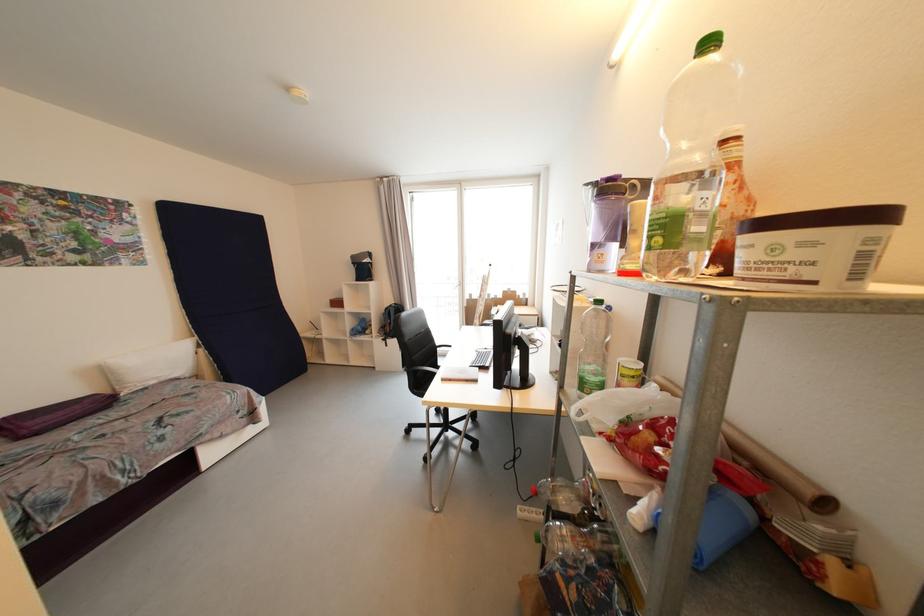
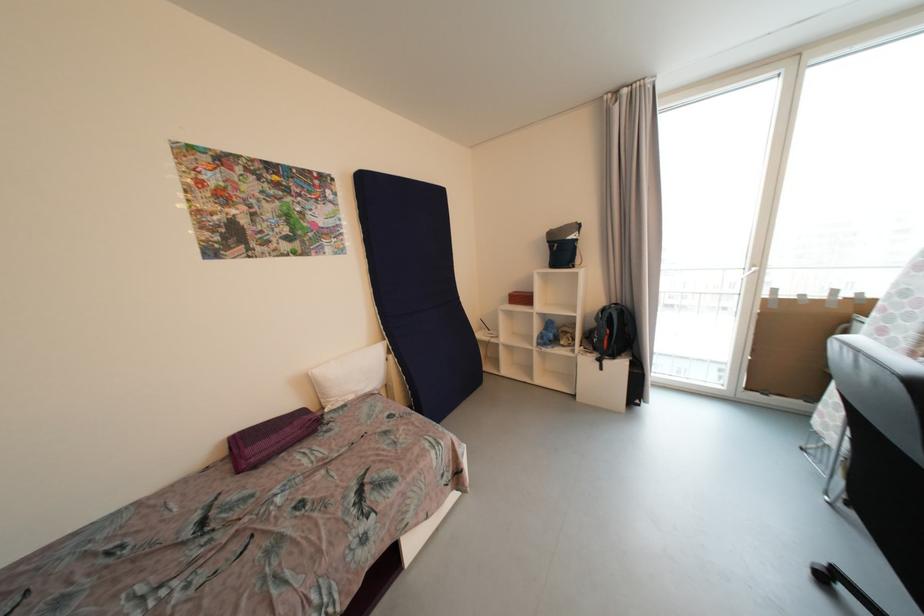
In a continuous first-person perspective shot, in which direction is the camera moving?

The cameraman moved toward left, forward.